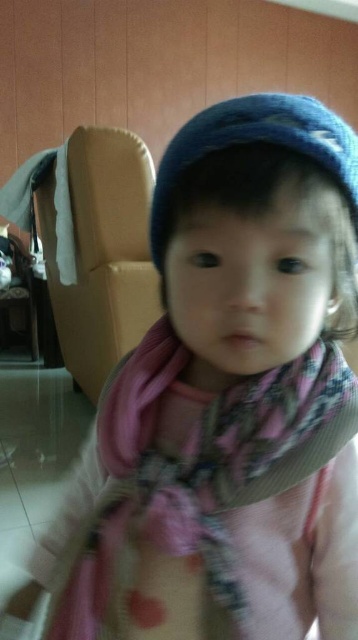
Does beige fabric armchair at left have a greater height compared to blue knitted hat at center?

Correct, beige fabric armchair at left is much taller as blue knitted hat at center.

Does point (98, 387) come in front of point (354, 205)?

No, (98, 387) is further to viewer.

Is point (74, 285) farther from viewer compared to point (345, 163)?

Yes, it is behind point (345, 163).

This screenshot has width=358, height=640. In order to click on beige fabric armchair at left in this screenshot , I will do `click(102, 252)`.

Is point (133, 388) behind point (342, 154)?

That is True.

Does point (143, 438) come closer to viewer compared to point (234, 97)?

Yes, point (143, 438) is in front of point (234, 97).

Is point (274, 564) less distant than point (186, 132)?

No, (274, 564) is further to viewer.

This screenshot has height=640, width=358. In order to click on pink plaid scarf at center in this screenshot , I will do `click(206, 490)`.

Is point (262, 465) positioned behind point (90, 307)?

No.

Can you confirm if pink plaid scarf at center is bigger than beige fabric armchair at left?

No, pink plaid scarf at center is not bigger than beige fabric armchair at left.

Is point (133, 547) in front of point (104, 369)?

Yes.

This screenshot has height=640, width=358. Find the location of `pink plaid scarf at center`. pink plaid scarf at center is located at coordinates (206, 490).